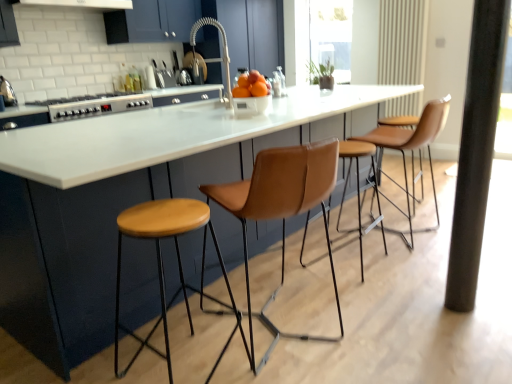
Where is `matte white bowl at center`? matte white bowl at center is located at coordinates (251, 85).

Looking at this image, what is the approximate height of leather-like brown stool at right, the 1th chair viewed from the back?

leather-like brown stool at right, the 1th chair viewed from the back, is 36.17 inches tall.

You are a GUI agent. You are given a task and a screenshot of the screen. Output one action in this format:
    pyautogui.click(x=<x>, y=<y>)
    Task: Click on the leather-like brown stool at right, the 1th chair viewed from the back
    This screenshot has width=512, height=384.
    Given the screenshot: What is the action you would take?
    pyautogui.click(x=410, y=150)

What do you see at coordinates (323, 37) in the screenshot? I see `transparent glass window screen at upper center` at bounding box center [323, 37].

Locate an element on the screen. The height and width of the screenshot is (384, 512). wooden stool at center is located at coordinates (163, 267).

From the silver metallic stove at left, count 2nd chair to the right and point to it. Please provide its 2D coordinates.

[(410, 150)]

Which object is closer to the camera, silver metallic stove at left or leather-like brown stool at right, the 1th chair viewed from the back?

leather-like brown stool at right, the 1th chair viewed from the back, is closer to the camera.

Is silver metallic stove at left far from leather-like brown stool at right, the 2th chair viewed from the left?

Yes, silver metallic stove at left and leather-like brown stool at right, the 2th chair viewed from the left, are quite far apart.

Between silver metallic stove at left and leather-like brown stool at right, the 2th chair viewed from the left, which one has larger size?

Bigger between the two is leather-like brown stool at right, the 2th chair viewed from the left.

Does silver metallic stove at left lie behind matte white bowl at center?

Yes, it is.

Based on the photo, considering the sizes of objects silver metallic stove at left and matte white bowl at center in the image provided, who is thinner, silver metallic stove at left or matte white bowl at center?

matte white bowl at center.

Is silver metallic stove at left facing towards matte white bowl at center?

Yes, silver metallic stove at left is turned towards matte white bowl at center.

Considering the relative sizes of silver metallic stove at left and matte white bowl at center in the image provided, is silver metallic stove at left bigger than matte white bowl at center?

Indeed, silver metallic stove at left has a larger size compared to matte white bowl at center.

At what (x,y) coordinates should I click in order to perform the action: click on kitchen appliance below the matte white bowl at center (from a real-world perspective). Please return your answer as a coordinate pair (x, y). The width and height of the screenshot is (512, 384). Looking at the image, I should click on (7, 93).

Would you say matte white bowl at center is a long distance from metallic silver kettle at left?

matte white bowl at center is far away from metallic silver kettle at left.

Considering the positions of point (263, 81) and point (1, 91), is point (263, 81) closer or farther from the camera than point (1, 91)?

Clearly, point (263, 81) is closer to the camera than point (1, 91).

Does point (155, 324) come closer to viewer compared to point (465, 129)?

No, (155, 324) is further to viewer.

Locate an element on the screen. This screenshot has height=384, width=512. stool below the black matte pillar at right (from a real-world perspective) is located at coordinates (163, 267).

In the scene shown: Does wooden stool at center appear on the left side of black matte pillar at right?

Correct, you'll find wooden stool at center to the left of black matte pillar at right.

From a real-world perspective, which object rests below the other?

wooden stool at center is physically lower.

Is point (166, 213) closer to camera compared to point (226, 94)?

Yes, it is.

In terms of width, does wooden stool at center look wider or thinner when compared to satin nickel faucet at center?

wooden stool at center is wider than satin nickel faucet at center.

Consider the image. Who is smaller, silver metallic stove at left or metallic silver kettle at left?

With smaller size is metallic silver kettle at left.

From a real-world perspective, who is located lower, silver metallic stove at left or metallic silver kettle at left?

From a 3D spatial view, silver metallic stove at left is below.

What's the angular difference between silver metallic stove at left and metallic silver kettle at left's facing directions?

0.999 degrees separate the facing orientations of silver metallic stove at left and metallic silver kettle at left.

Looking at this image, does silver metallic stove at left appear on the right side of metallic silver kettle at left?

Indeed, silver metallic stove at left is positioned on the right side of metallic silver kettle at left.

Which object is closer to the camera, black matte pillar at right or metallic silver kettle at left?

black matte pillar at right is in front.

Can you see black matte pillar at right touching metallic silver kettle at left?

They are not placed beside each other.

In order to click on pillar below the metallic silver kettle at left (from the image's perspective) in this screenshot , I will do `click(476, 150)`.

Does point (479, 259) come farther from viewer compared to point (12, 100)?

No, (479, 259) is in front of (12, 100).

Identify the location of appliance on the left of the leather-like brown stool at right, the 2th chair viewed from the left. The width and height of the screenshot is (512, 384). (94, 105).

I want to click on appliance above the matte white bowl at center (from the image's perspective), so click(x=94, y=105).

When comparing their distances from wooden stool at center, does silver metallic stove at left or leather at center, the 2th chair when ordered from right to left, seem closer?

leather at center, the 2th chair when ordered from right to left, is closer to wooden stool at center.

Based on their spatial positions, is silver metallic stove at left or leather at center, which appears as the first chair when viewed from the left, closer to satin nickel faucet at center?

Based on the image, silver metallic stove at left appears to be nearer to satin nickel faucet at center.

Consider the image. When comparing their distances from transparent glass window screen at upper center, does metallic silver kettle at left or satin nickel faucet at center seem closer?

satin nickel faucet at center lies closer to transparent glass window screen at upper center than the other object.

Consider the image. When comparing their distances from leather at center, which is counted as the first chair, starting from the front, does black matte pillar at right or satin nickel faucet at center seem closer?

The object closer to leather at center, which is counted as the first chair, starting from the front, is black matte pillar at right.

From the image, which object appears to be nearer to black matte pillar at right, metallic silver kettle at left or satin nickel faucet at center?

The object closer to black matte pillar at right is metallic silver kettle at left.

Which object lies nearer to the anchor point leather at center, which appears as the first chair when viewed from the left, wooden stool at center or transparent glass window screen at upper center?

The object closer to leather at center, which appears as the first chair when viewed from the left, is wooden stool at center.

Considering their positions, is metallic silver kettle at left positioned further to leather at center, the 2th chair when ordered from right to left, than matte white bowl at center?

Based on the image, metallic silver kettle at left appears to be further to leather at center, the 2th chair when ordered from right to left.

Which object lies nearer to the anchor point black matte pillar at right, silver metallic stove at left or metallic silver kettle at left?

silver metallic stove at left is closer to black matte pillar at right.

The image size is (512, 384). Find the location of `orange situated between metallic silver kettle at left and leather-like brown stool at right, the 2th chair in the front-to-back sequence, from left to right`. orange situated between metallic silver kettle at left and leather-like brown stool at right, the 2th chair in the front-to-back sequence, from left to right is located at coordinates (251, 85).

Identify the location of orange between wooden stool at center and leather-like brown stool at right, the 2th chair in the front-to-back sequence. The width and height of the screenshot is (512, 384). coord(251,85).

Where is `orange between black matte pillar at right and transparent glass window screen at upper center in the front-back direction`? The width and height of the screenshot is (512, 384). orange between black matte pillar at right and transparent glass window screen at upper center in the front-back direction is located at coordinates (251, 85).

The height and width of the screenshot is (384, 512). In order to click on faucet between metallic silver kettle at left and transparent glass window screen at upper center in this screenshot , I will do `click(212, 58)`.